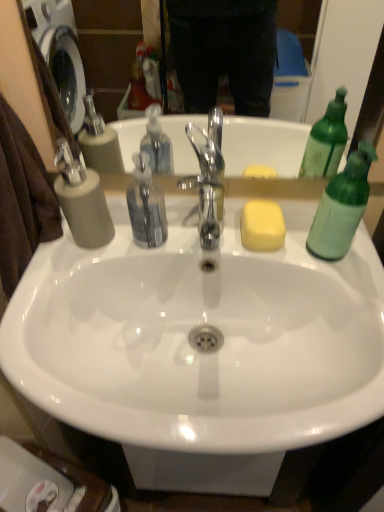
Question: Considering the positions of green translucent bottle at right and yellow matte soap at center in the image, is green translucent bottle at right taller or shorter than yellow matte soap at center?

Choices:
 (A) tall
 (B) short

Answer: (A)

Question: Based on their positions, is green translucent bottle at right located to the left or right of yellow matte soap at center?

Choices:
 (A) right
 (B) left

Answer: (A)

Question: Which of these objects is positioned closest to the green translucent bottle at right?

Choices:
 (A) yellow matte soap at center
 (B) white glossy sink at center
 (C) matte gray soap dispenser at left

Answer: (A)

Question: Estimate the real-world distances between objects in this image. Which object is farther from the matte gray soap dispenser at left?

Choices:
 (A) yellow matte soap at center
 (B) white glossy sink at center
 (C) green translucent bottle at right

Answer: (C)